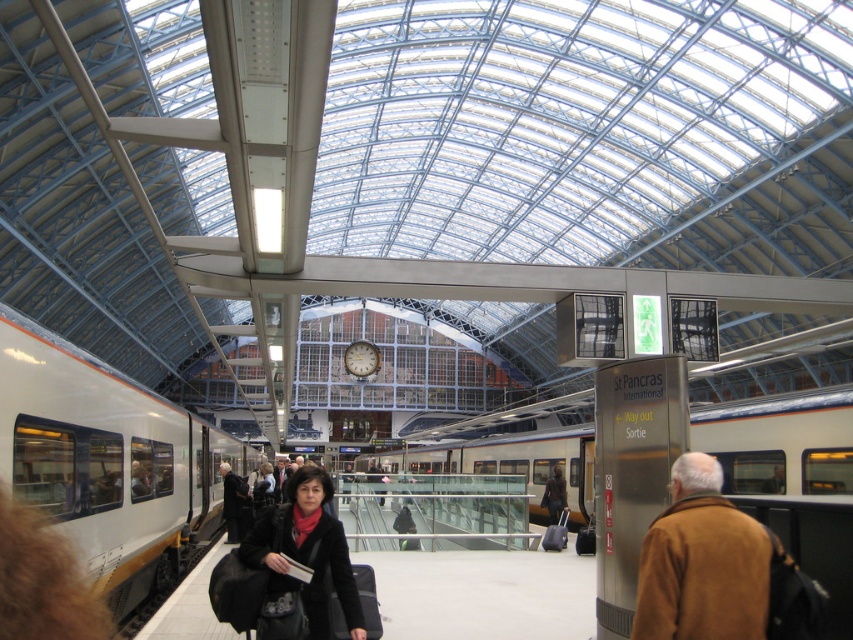
Question: Can you confirm if velvet black coat at center is thinner than dark brown leather jacket at center?

Choices:
 (A) yes
 (B) no

Answer: (B)

Question: Which point is farther from the camera taking this photo?

Choices:
 (A) (80, 369)
 (B) (315, 513)
 (C) (223, 472)

Answer: (C)

Question: Which point is farther from the camera taking this photo?

Choices:
 (A) coord(732,524)
 (B) coord(787,492)
 (C) coord(556,508)

Answer: (C)

Question: Can you confirm if silver metallic train at center is wider than dark brown leather jacket at center?

Choices:
 (A) no
 (B) yes

Answer: (B)

Question: Which object is closer to the camera taking this photo?

Choices:
 (A) silver metallic train at center
 (B) white glossy train at left
 (C) brown leather jacket at lower right

Answer: (C)

Question: Is silver metallic train at center positioned at the back of velvet black coat at center?

Choices:
 (A) no
 (B) yes

Answer: (B)